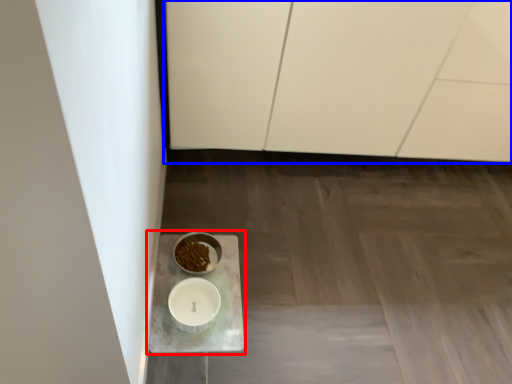
Question: Among these objects, which one is farthest to the camera, table (highlighted by a red box) or cabinetry (highlighted by a blue box)?

Choices:
 (A) table
 (B) cabinetry

Answer: (A)